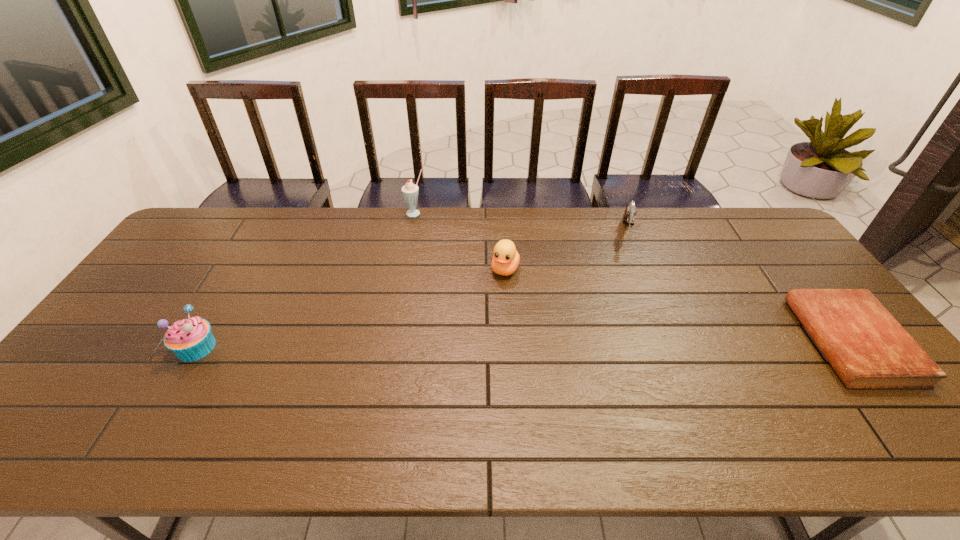
The width and height of the screenshot is (960, 540). In order to click on muffin in this screenshot , I will do click(x=191, y=339).

The height and width of the screenshot is (540, 960). I want to click on Bible, so click(x=867, y=347).

The height and width of the screenshot is (540, 960). I want to click on the rightmost object, so 867,347.

Locate an element on the screen. This screenshot has width=960, height=540. milkshake is located at coordinates 410,191.

At what (x,y) coordinates should I click in order to perform the action: click on the second object from left to right. Please return your answer as a coordinate pair (x, y). The image size is (960, 540). Looking at the image, I should click on (410, 191).

Identify the location of the fourth object from left to right. (628, 217).

The height and width of the screenshot is (540, 960). What are the coordinates of `the third nearest object` in the screenshot? It's located at (505, 261).

Locate an element on the screen. The image size is (960, 540). duckling is located at coordinates (505, 261).

You are a GUI agent. You are given a task and a screenshot of the screen. Output one action in this format:
    pyautogui.click(x=<x>, y=<y>)
    Task: Click on the vacant space positioned on the right of the muffin
    
    Given the screenshot: What is the action you would take?
    tap(258, 347)

This screenshot has width=960, height=540. Find the location of `free location located on the spine side of the rightmost object`. free location located on the spine side of the rightmost object is located at coordinates (724, 341).